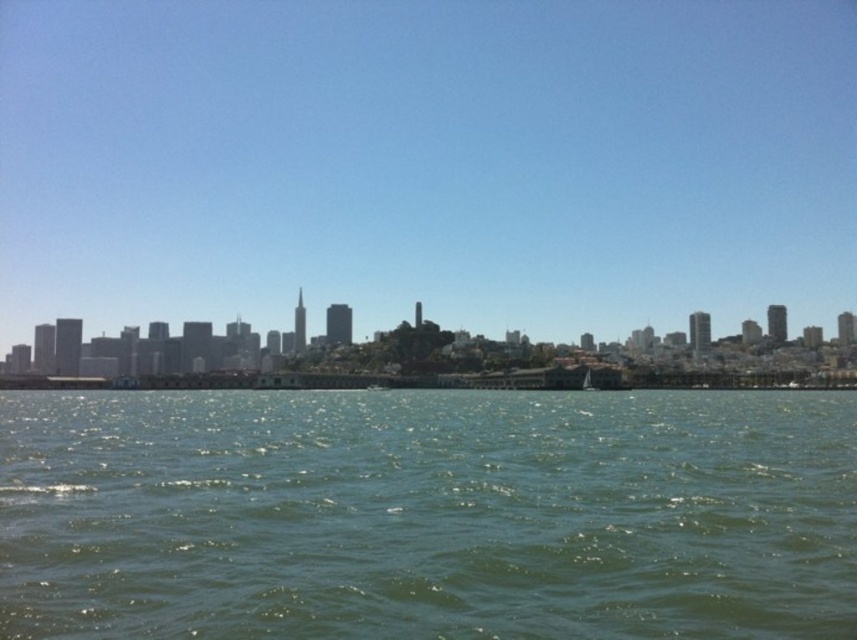
You are a drone operator trying to capture a photo of the city skyline. You notice a point at coordinates (427,515) in the image. What is present at this point?

At point (427,515) lies green liquid water at lower center.

You are an architect designing a new bridge that needs to span the green liquid water at lower center without obstructing the view of the transparent glass skyline at center. Based on the scene, can you confirm if the proposed bridge design, which will be 2 meters tall, will allow the skyline to remain visible from the shore?

The transparent glass skyline at center is located above the green liquid water at lower center, so the proposed bridge design at 2 meters tall will not obstruct the view of the skyline as it is positioned above the water level.